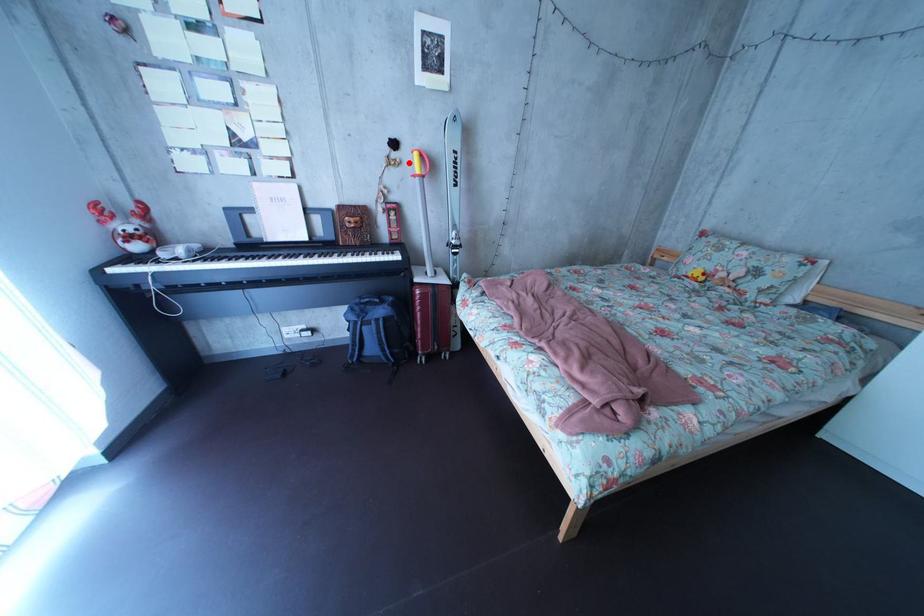
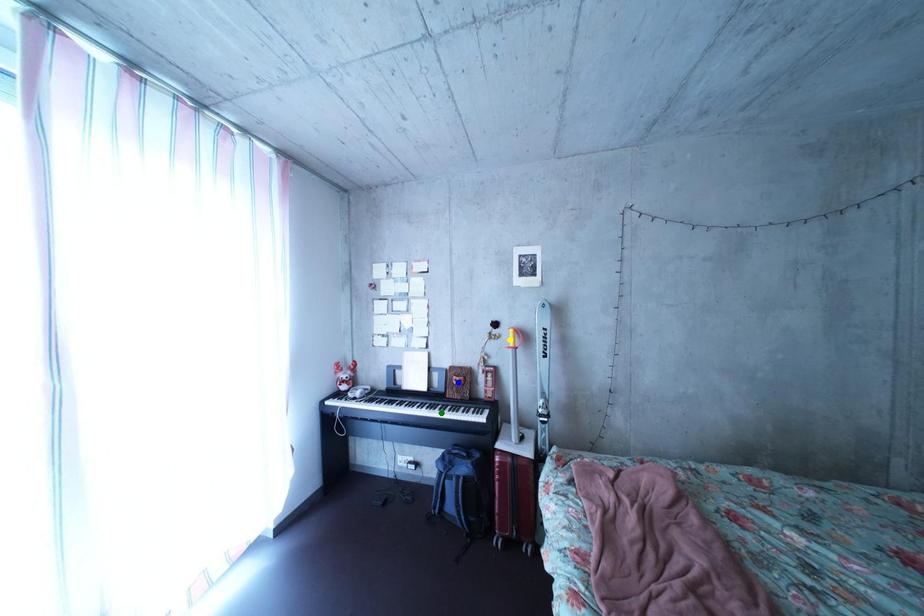
Question: I am providing you with two images of the same scene from different viewpoints. A red point is marked on the first image. You are given multiple points on the second image. Can you choose the point in image 2 that corresponds to the point in image 1?

Choices:
 (A) green point
 (B) yellow point
 (C) blue point

Answer: (B)